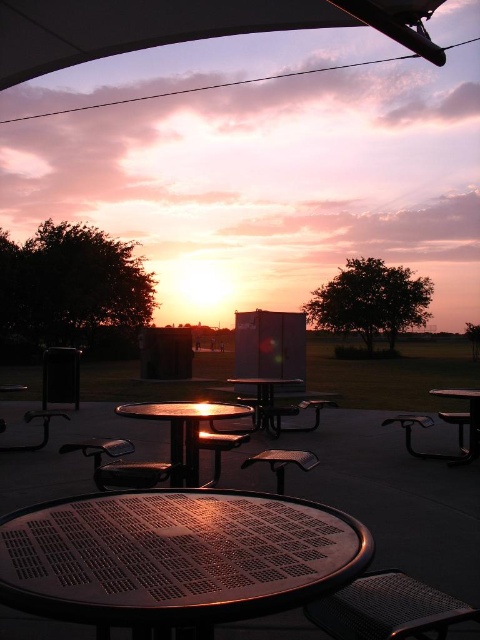
In the scene shown: You are planning to set up a picnic and need to place a blanket on the ground. You see the metallic perforated table at center and the metallic black table at center. Which table should you place the blanket under to ensure it stays dry if it rains?

The metallic perforated table at center is above the metallic black table at center, so placing the blanket under the metallic perforated table at center would provide better shelter from rain.

You are planning to place a large rectangular picnic basket on the metallic black table at center and the metallic silver table at lower right. Which table is more suitable for the basket based on their widths?

The metallic silver table at lower right is more suitable for the large rectangular picnic basket because it is wider than the metallic black table at center.

You are planning to set up a picnic and need to choose between the metallic perforated table at center and the metallic black table at center. Which table has a greater width?

The metallic perforated table at center has a larger width than the metallic black table at center according to the description.